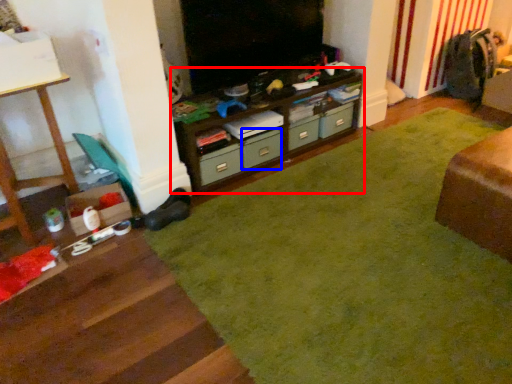
Question: Which point is further to the camera, cabinetry (highlighted by a red box) or drawer (highlighted by a blue box)?

Choices:
 (A) cabinetry
 (B) drawer

Answer: (B)